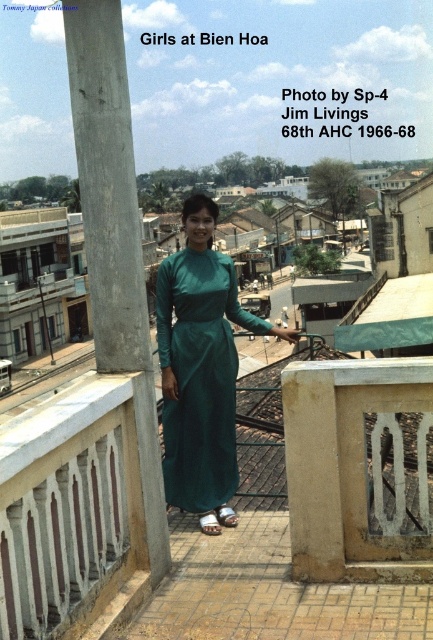
Is concrete at center shorter than emerald green silk dress at center?

In fact, concrete at center may be taller than emerald green silk dress at center.

Is point (90, 106) more distant than point (223, 472)?

No.

Locate an element on the screen. This screenshot has height=640, width=433. concrete at center is located at coordinates (115, 236).

Is white concrete porch at center thinner than concrete at center?

Yes.

Who is taller, white concrete porch at center or concrete at center?

Standing taller between the two is concrete at center.

Locate an element on the screen. This screenshot has height=640, width=433. white concrete porch at center is located at coordinates (71, 513).

Between white concrete porch at center and emerald green silk dress at center, which one has less height?

white concrete porch at center is shorter.

Looking at this image, can you confirm if white concrete porch at center is positioned above emerald green silk dress at center?

Incorrect, white concrete porch at center is not positioned above emerald green silk dress at center.

Is point (91, 557) behind point (183, 374)?

No, (91, 557) is closer to viewer.

Where is `white concrete porch at center`? This screenshot has width=433, height=640. white concrete porch at center is located at coordinates (71, 513).